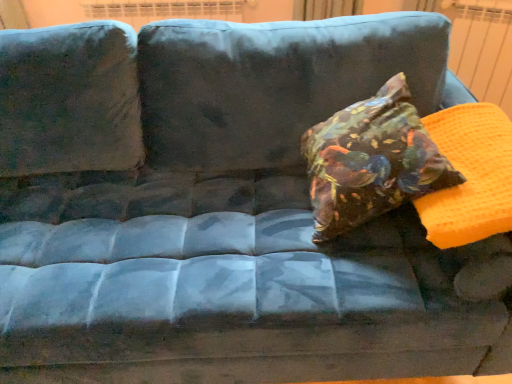
This screenshot has width=512, height=384. Describe the element at coordinates (478, 45) in the screenshot. I see `orange waffle-patterned radiator at upper right` at that location.

What are the coordinates of `orange waffle-patterned radiator at upper right` in the screenshot? It's located at (478, 45).

What do you see at coordinates (371, 161) in the screenshot? Image resolution: width=512 pixels, height=384 pixels. I see `floral fabric pillow at center` at bounding box center [371, 161].

In order to click on floral fabric pillow at center in this screenshot , I will do `click(371, 161)`.

Image resolution: width=512 pixels, height=384 pixels. Find the location of `orange waffle-patterned radiator at upper right`. orange waffle-patterned radiator at upper right is located at coordinates (478, 45).

Which object is positioned more to the left, floral fabric pillow at center or orange waffle-patterned radiator at upper right?

A: floral fabric pillow at center.

Considering the relative positions of floral fabric pillow at center and orange waffle-patterned radiator at upper right in the image provided, is floral fabric pillow at center in front of orange waffle-patterned radiator at upper right?

Yes, it is.

Is point (426, 175) less distant than point (487, 51)?

Yes, it is in front of point (487, 51).

From the image's perspective, is floral fabric pillow at center located beneath orange waffle-patterned radiator at upper right?

Yes, from the image's perspective, floral fabric pillow at center is beneath orange waffle-patterned radiator at upper right.

From a real-world perspective, is floral fabric pillow at center beneath orange waffle-patterned radiator at upper right?

No.

Which object is wider, floral fabric pillow at center or orange waffle-patterned radiator at upper right?

floral fabric pillow at center is wider.

Considering the relative sizes of floral fabric pillow at center and orange waffle-patterned radiator at upper right in the image provided, is floral fabric pillow at center taller than orange waffle-patterned radiator at upper right?

No, floral fabric pillow at center is not taller than orange waffle-patterned radiator at upper right.

Considering the sizes of floral fabric pillow at center and orange waffle-patterned radiator at upper right in the image, is floral fabric pillow at center bigger or smaller than orange waffle-patterned radiator at upper right?

Considering their sizes, floral fabric pillow at center takes up more space than orange waffle-patterned radiator at upper right.

Consider the image. Is orange waffle-patterned radiator at upper right a part of floral fabric pillow at center?

Definitely not — orange waffle-patterned radiator at upper right is not inside floral fabric pillow at center.

Would you say floral fabric pillow at center is a long distance from orange waffle-patterned radiator at upper right?

Yes.

Could you tell me if floral fabric pillow at center is facing orange waffle-patterned radiator at upper right?

No, floral fabric pillow at center is not facing towards orange waffle-patterned radiator at upper right.

Locate an element on the screen. The height and width of the screenshot is (384, 512). radiator above the floral fabric pillow at center (from the image's perspective) is located at coordinates (478, 45).

In the image, is orange waffle-patterned radiator at upper right on the left side or the right side of floral fabric pillow at center?

Based on their positions, orange waffle-patterned radiator at upper right is located to the right of floral fabric pillow at center.

Is the depth of orange waffle-patterned radiator at upper right less than that of floral fabric pillow at center?

No.

Considering the points (489, 58) and (338, 169), which point is in front, point (489, 58) or point (338, 169)?

Positioned in front is point (338, 169).

From the image's perspective, who appears lower, orange waffle-patterned radiator at upper right or floral fabric pillow at center?

floral fabric pillow at center, from the image's perspective.

From a real-world perspective, which object rests below the other?

orange waffle-patterned radiator at upper right is physically lower.

Is orange waffle-patterned radiator at upper right thinner than floral fabric pillow at center?

Indeed, orange waffle-patterned radiator at upper right has a lesser width compared to floral fabric pillow at center.

Considering the relative sizes of orange waffle-patterned radiator at upper right and floral fabric pillow at center in the image provided, is orange waffle-patterned radiator at upper right taller than floral fabric pillow at center?

Indeed, orange waffle-patterned radiator at upper right has a greater height compared to floral fabric pillow at center.

Which of these two, orange waffle-patterned radiator at upper right or floral fabric pillow at center, is smaller?

With smaller size is orange waffle-patterned radiator at upper right.

Is orange waffle-patterned radiator at upper right located outside floral fabric pillow at center?

Yes, orange waffle-patterned radiator at upper right is located beyond the bounds of floral fabric pillow at center.

Is orange waffle-patterned radiator at upper right far from floral fabric pillow at center?

Yes.

Could you tell me if orange waffle-patterned radiator at upper right is facing floral fabric pillow at center?

Yes, orange waffle-patterned radiator at upper right is facing floral fabric pillow at center.

The image size is (512, 384). I want to click on radiator lying behind the floral fabric pillow at center, so click(478, 45).

In order to click on throw pillow that appears above the orange waffle-patterned radiator at upper right (from a real-world perspective) in this screenshot , I will do `click(371, 161)`.

Image resolution: width=512 pixels, height=384 pixels. I want to click on radiator located on the right of floral fabric pillow at center, so click(x=478, y=45).